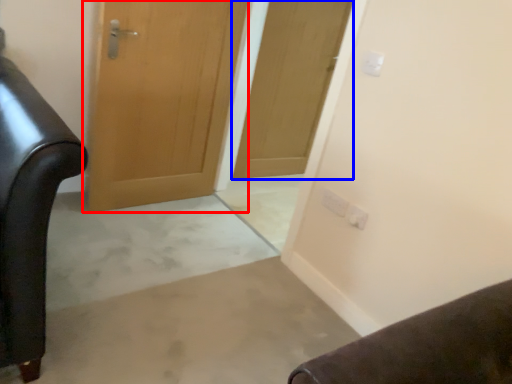
Question: Which point is further to the camera, door (highlighted by a red box) or door (highlighted by a blue box)?

Choices:
 (A) door
 (B) door

Answer: (B)